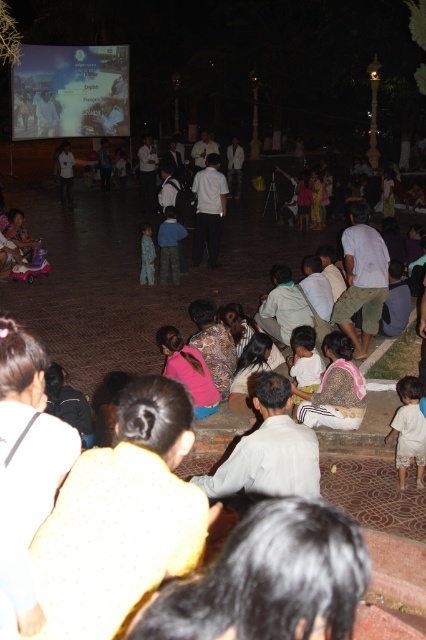
Question: Does white cotton shirt at lower right have a smaller size compared to white cotton shirt at center?

Choices:
 (A) yes
 (B) no

Answer: (B)

Question: Estimate the real-world distances between objects in this image. Which object is farther from the white cotton shirt at lower right?

Choices:
 (A) blue denim pants at center
 (B) light blue pajamas at center
 (C) white cotton shirt at center

Answer: (B)

Question: Observing the image, what is the correct spatial positioning of white cotton shirt at lower right in reference to blue denim pants at center?

Choices:
 (A) below
 (B) above

Answer: (A)

Question: Which object is positioned farthest from the white cotton shirt at center?

Choices:
 (A) white cotton shirt at lower right
 (B) blue denim pants at center
 (C) light blue pajamas at center

Answer: (C)

Question: Which point appears closest to the camera in this image?

Choices:
 (A) (420, 442)
 (B) (141, 282)
 (C) (164, 273)
 (D) (308, 369)

Answer: (A)

Question: Is white cotton shirt at lower right bigger than blue denim pants at center?

Choices:
 (A) yes
 (B) no

Answer: (B)